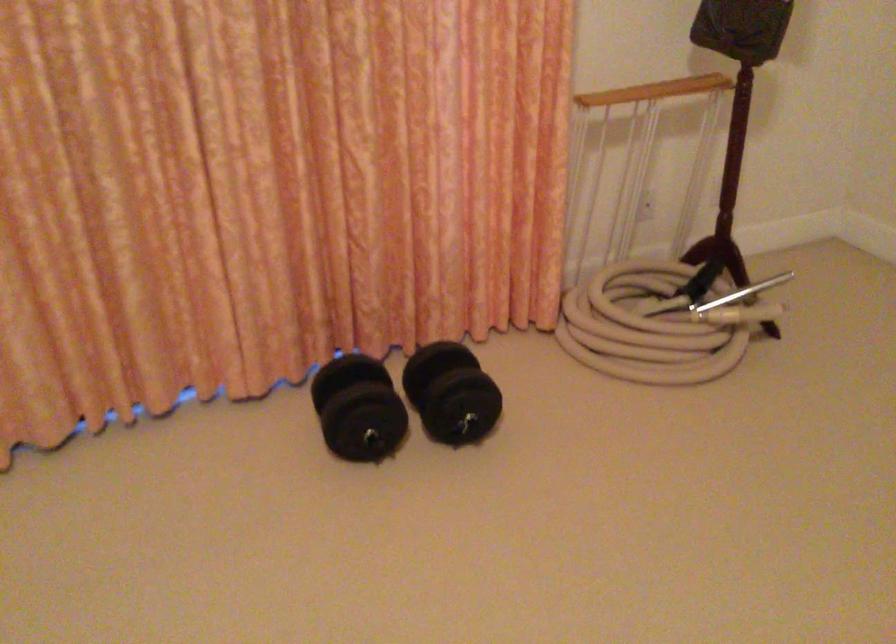
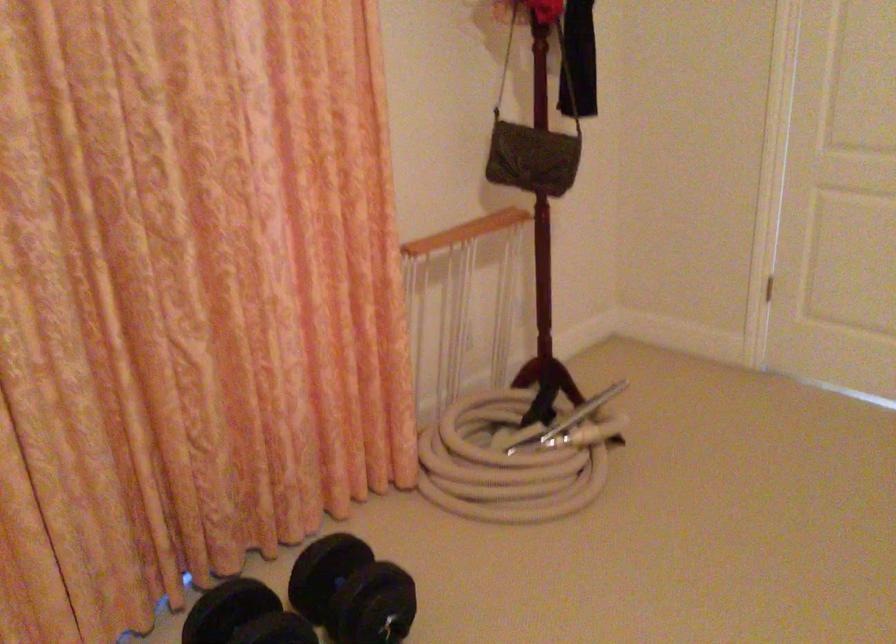
Question: The camera is either moving clockwise (left) or counter-clockwise (right) around the object. The first image is from the beginning of the video and the second image is from the end. Is the camera moving left or right when shooting the video?

Choices:
 (A) Left
 (B) Right

Answer: (A)